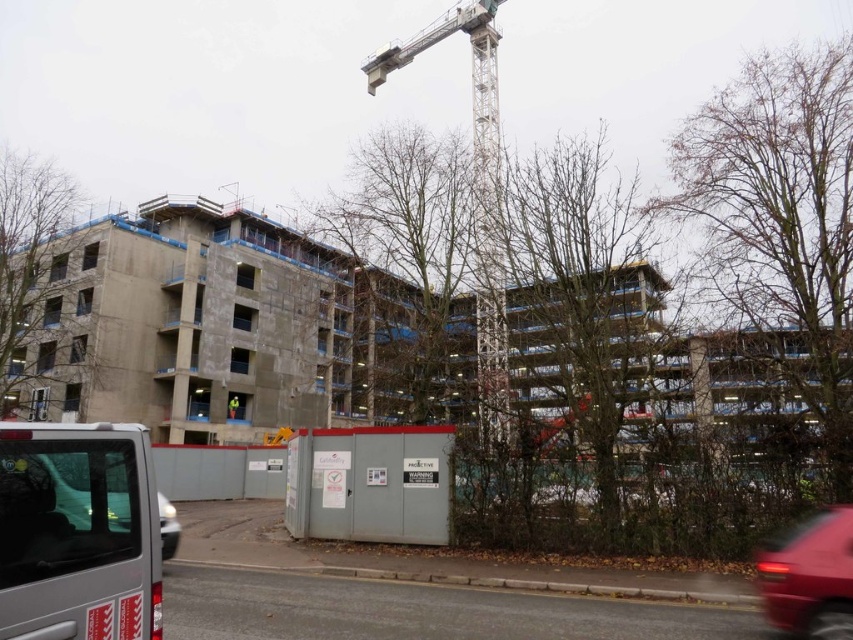
Does gray concrete construction site at center appear under metallic gray crane at upper center?

Indeed, gray concrete construction site at center is positioned under metallic gray crane at upper center.

Which is more to the right, gray concrete construction site at center or metallic gray crane at upper center?

Positioned to the right is metallic gray crane at upper center.

Is point (202, 596) closer to viewer compared to point (444, 17)?

Yes, it is.

Where is `gray concrete construction site at center`? The image size is (853, 640). gray concrete construction site at center is located at coordinates (399, 600).

Can you confirm if metallic gray crane at upper center is taller than green fabric construction worker at center?

Yes.

Does metallic gray crane at upper center come in front of green fabric construction worker at center?

Yes, it is.

Is point (425, 36) closer to viewer compared to point (233, 401)?

That is True.

This screenshot has width=853, height=640. I want to click on metallic gray crane at upper center, so click(474, 196).

Is the position of matte black van at lower left less distant than that of green fabric construction worker at center?

Yes.

The height and width of the screenshot is (640, 853). Identify the location of matte black van at lower left. (67, 484).

The width and height of the screenshot is (853, 640). I want to click on matte black van at lower left, so click(x=67, y=484).

Image resolution: width=853 pixels, height=640 pixels. I want to click on matte black van at lower left, so click(x=67, y=484).